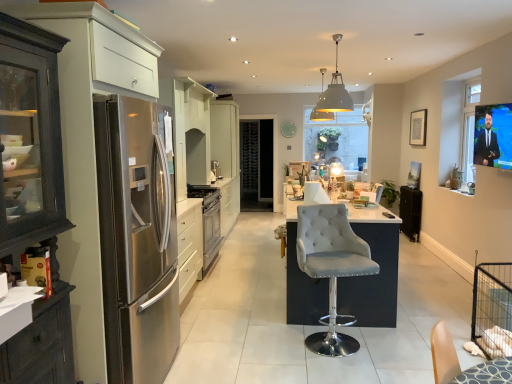
Find the location of a particular element. The image size is (512, 384). empty space that is ontop of matte gray pendant light at center (from a real-world perspective) is located at coordinates (336, 30).